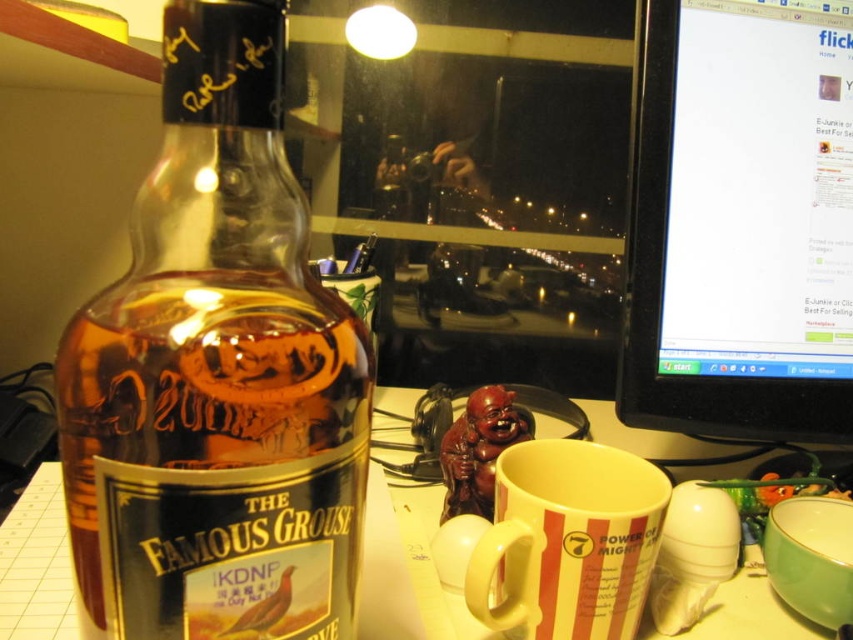
Does black glossy monitor at right have a greater width compared to white glossy table at lower center?

No.

Is black glossy monitor at right below white glossy table at lower center?

No, black glossy monitor at right is not below white glossy table at lower center.

This screenshot has width=853, height=640. What do you see at coordinates (740, 220) in the screenshot?
I see `black glossy monitor at right` at bounding box center [740, 220].

Where is `black glossy monitor at right`? black glossy monitor at right is located at coordinates (740, 220).

Between white glossy table at lower center and white striped mug at center, which one appears on the right side from the viewer's perspective?

From the viewer's perspective, white striped mug at center appears more on the right side.

Who is more forward, (770, 625) or (637, 483)?

Point (637, 483)

This screenshot has width=853, height=640. I want to click on white glossy table at lower center, so click(x=399, y=563).

From the picture: Is translucent glass bottle at left below black glossy monitor at right?

Indeed, translucent glass bottle at left is positioned under black glossy monitor at right.

Is translucent glass bottle at left bigger than black glossy monitor at right?

No.

Who is more distant from viewer, (137, 353) or (821, 237)?

Positioned behind is point (821, 237).

You are a GUI agent. You are given a task and a screenshot of the screen. Output one action in this format:
    pyautogui.click(x=<x>, y=<y>)
    Task: Click on the translucent glass bottle at left
    
    Given the screenshot: What is the action you would take?
    pyautogui.click(x=216, y=372)